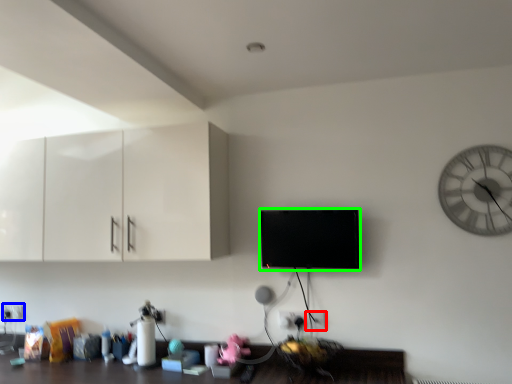
Question: Estimate the real-world distances between objects in this image. Which object is closer to electric outlet (highlighted by a red box), electric outlet (highlighted by a blue box) or flat (highlighted by a green box)?

Choices:
 (A) electric outlet
 (B) flat

Answer: (B)